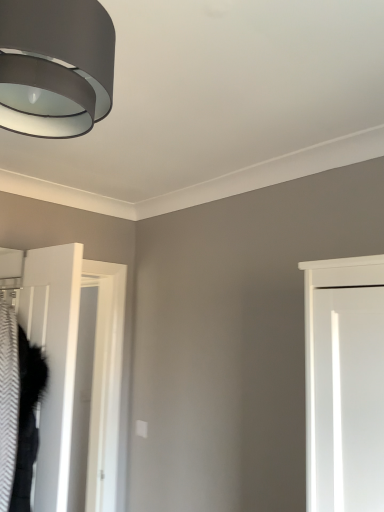
Question: From a real-world perspective, is matte black lampshade at upper left above or below white matte door at left?

Choices:
 (A) below
 (B) above

Answer: (B)

Question: From the image's perspective, relative to white matte door at left, is matte black lampshade at upper left above or below?

Choices:
 (A) above
 (B) below

Answer: (A)

Question: In terms of size, does matte black lampshade at upper left appear bigger or smaller than white matte door at left?

Choices:
 (A) big
 (B) small

Answer: (B)

Question: Looking at the image, does white matte door at left seem bigger or smaller compared to matte black lampshade at upper left?

Choices:
 (A) big
 (B) small

Answer: (A)

Question: Based on their positions, is white matte door at left located to the left or right of matte black lampshade at upper left?

Choices:
 (A) left
 (B) right

Answer: (A)

Question: Considering the positions of white matte door at left and matte black lampshade at upper left in the image, is white matte door at left taller or shorter than matte black lampshade at upper left?

Choices:
 (A) tall
 (B) short

Answer: (A)

Question: Considering the positions of point [x=99, y=296] and point [x=82, y=79], is point [x=99, y=296] closer or farther from the camera than point [x=82, y=79]?

Choices:
 (A) farther
 (B) closer

Answer: (A)